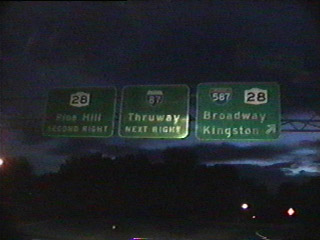
The height and width of the screenshot is (240, 320). I want to click on lights, so click(x=295, y=209), click(x=245, y=204), click(x=1, y=163), click(x=116, y=227).